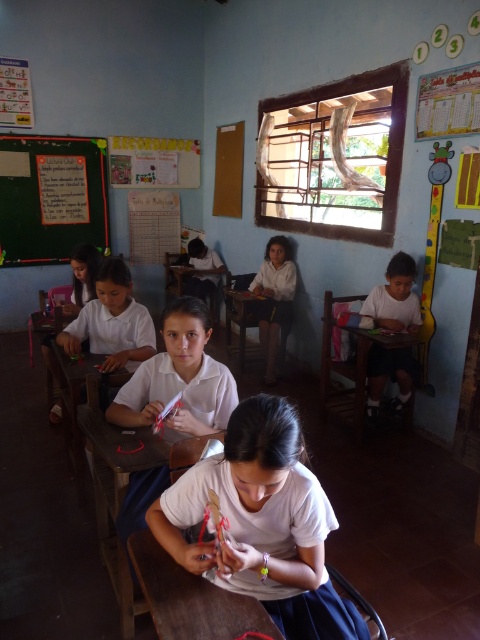
Between point (155, 596) and point (229, 291), which one is positioned behind?

The point (229, 291) is behind.

Between point (190, 600) and point (240, 358), which one is positioned behind?

The point (240, 358) is more distant.

Find the location of a particular element. This screenshot has width=480, height=640. brown wooden table at lower center is located at coordinates (191, 598).

Does green chalkboard at upper left come in front of white matte shirt at right?

That is False.

Is green chalkboard at upper left smaller than white matte shirt at right?

Actually, green chalkboard at upper left might be larger than white matte shirt at right.

What do you see at coordinates (52, 198) in the screenshot?
I see `green chalkboard at upper left` at bounding box center [52, 198].

Identify the location of green chalkboard at upper left. (52, 198).

Is point (104, 164) more distant than point (363, 362)?

Yes, it is.

Who is positioned more to the right, green chalkboard at upper left or wooden table at right?

From the viewer's perspective, wooden table at right appears more on the right side.

Describe the element at coordinates (52, 198) in the screenshot. I see `green chalkboard at upper left` at that location.

Image resolution: width=480 pixels, height=640 pixels. I want to click on green chalkboard at upper left, so click(x=52, y=198).